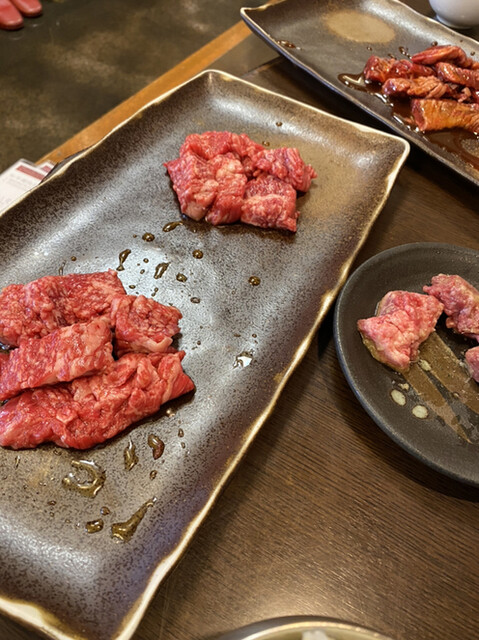
This screenshot has height=640, width=479. Find the location of `black plate`. black plate is located at coordinates tap(401, 443).